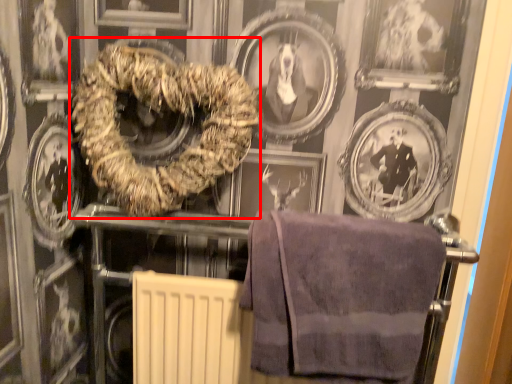
Question: Observing the image, what is the correct spatial positioning of towel (annotated by the red box) in reference to towel?

Choices:
 (A) right
 (B) left

Answer: (B)